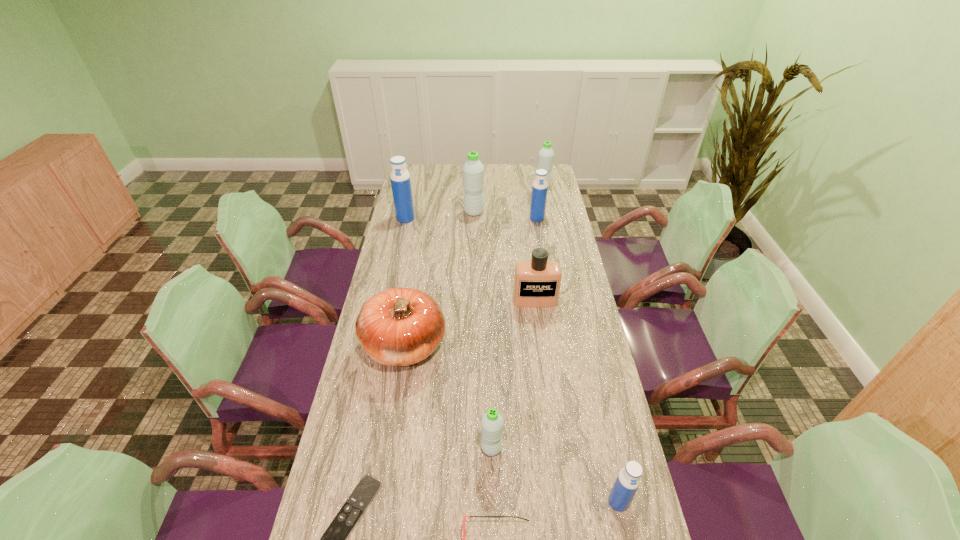
Identify the location of the smallest green water bottle. (492, 422).

Identify the location of the fifth farthest water bottle. The width and height of the screenshot is (960, 540). (492, 422).

The width and height of the screenshot is (960, 540). I want to click on the nearest water bottle, so click(x=628, y=480).

I want to click on the rightmost blue water bottle, so click(x=628, y=480).

The image size is (960, 540). Identify the location of vacant space situated 0.370m on the back of the second nearest green water bottle. (474, 169).

Where is `vacant area situated on the back of the leftmost water bottle`? The image size is (960, 540). vacant area situated on the back of the leftmost water bottle is located at coordinates (413, 187).

I want to click on vacant position located on the left of the second smallest green water bottle, so click(x=465, y=187).

This screenshot has width=960, height=540. In order to click on vacant space positioned on the front of the second biggest blue water bottle in this screenshot , I will do `click(540, 235)`.

Where is `free region located 0.140m on the front label of the perfume`? free region located 0.140m on the front label of the perfume is located at coordinates (540, 337).

Where is `vacant space situated 0.320m on the right of the orange pumpkin`? vacant space situated 0.320m on the right of the orange pumpkin is located at coordinates (542, 346).